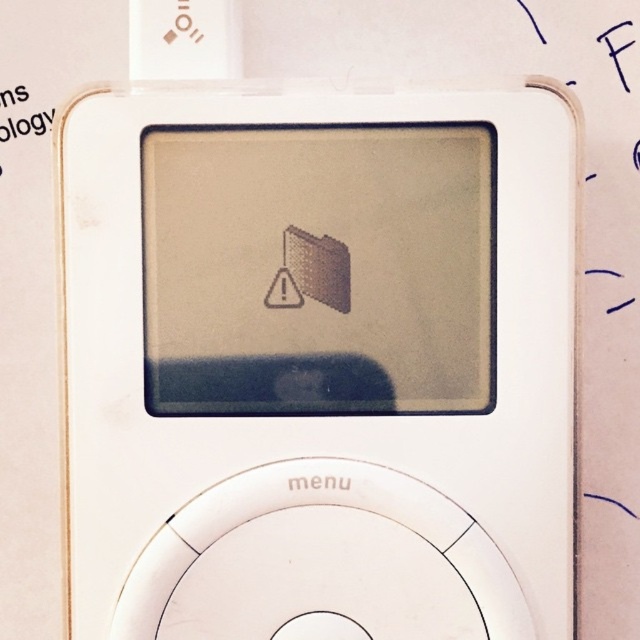
Who is more distant from viewer, (525,515) or (19,100)?

Point (19,100)

Where is `white plastic ipod at center`? Image resolution: width=640 pixels, height=640 pixels. white plastic ipod at center is located at coordinates (317, 362).